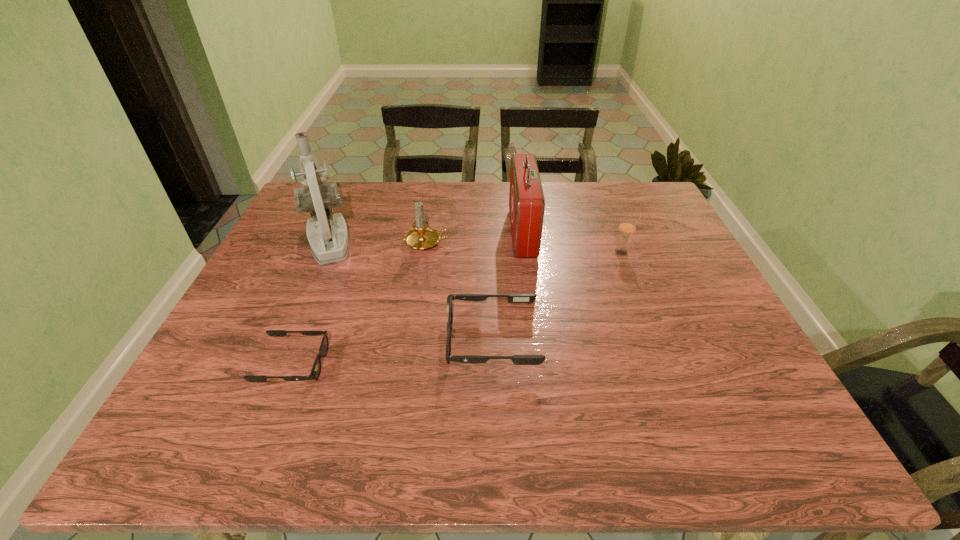
Locate an element on the screen. free spot between the taller sunglasses and the rightmost object is located at coordinates (x=557, y=296).

I want to click on vacant region between the second tallest object and the candle, so click(475, 238).

Image resolution: width=960 pixels, height=540 pixels. What are the coordinates of `empty space that is in between the rightmost object and the left sunglasses` in the screenshot? It's located at (458, 308).

At what (x,y) coordinates should I click in order to perform the action: click on free space between the second tallest object and the left sunglasses. Please return your answer as a coordinate pair (x, y). The width and height of the screenshot is (960, 540). Looking at the image, I should click on (408, 299).

Locate an element on the screen. This screenshot has width=960, height=540. vacant point located between the left sunglasses and the straw is located at coordinates (458, 308).

Locate an element on the screen. Image resolution: width=960 pixels, height=540 pixels. free area in between the rightmost object and the shortest object is located at coordinates (458, 308).

In order to click on object identified as the fourth closest to the fourth object from right to left in this screenshot , I will do `click(316, 369)`.

Locate which object is the third closest to the first-aid kit. Please provide its 2D coordinates. Your answer should be formatted as a tuple, i.e. [(x, y)], where the tuple contains the x and y coordinates of a point satisfying the conditions above.

[(627, 227)]

This screenshot has width=960, height=540. Identify the location of free spot that satisfies the following two spatial constraints: 1. on the side of the second tallest object with the first aid cross symbol; 2. on the left side of the rightmost object. (525, 253).

Find the location of a particular element. vacant area in the image that satisfies the following two spatial constraints: 1. on the front side of the straw; 2. on the temples of the taller sunglasses is located at coordinates (657, 341).